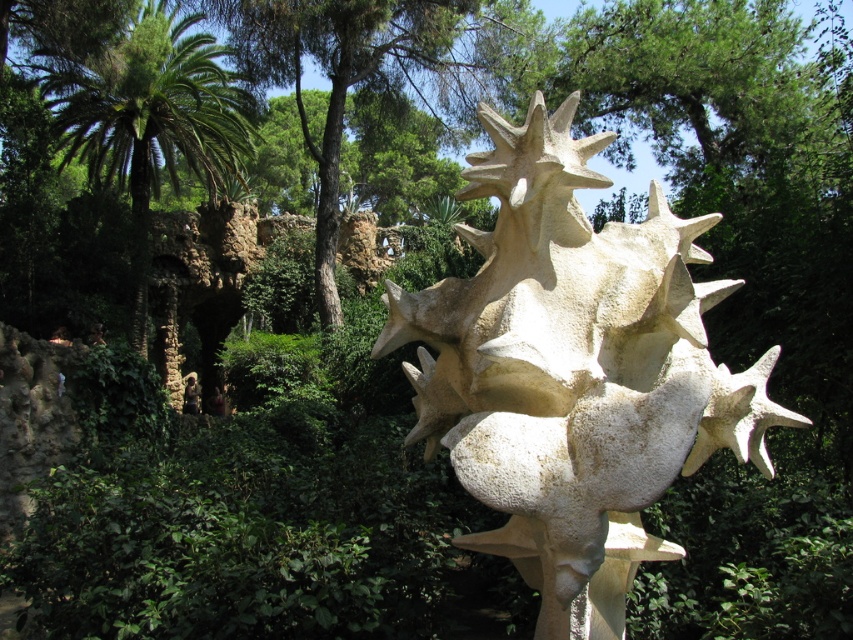
Can you confirm if green leafy tree at upper center is wider than green leafy palm at left?

No, green leafy tree at upper center is not wider than green leafy palm at left.

Identify the location of green leafy tree at upper center. (361, 72).

At what (x,y) coordinates should I click in order to perform the action: click on green leafy tree at upper center. Please return your answer as a coordinate pair (x, y). The height and width of the screenshot is (640, 853). Looking at the image, I should click on (361, 72).

Consider the image. Can you confirm if white stone sculpture at center is positioned below green leafy tree at upper center?

Yes, white stone sculpture at center is below green leafy tree at upper center.

From the picture: Does white stone sculpture at center come in front of green leafy tree at upper center?

Yes, it is in front of green leafy tree at upper center.

You are a GUI agent. You are given a task and a screenshot of the screen. Output one action in this format:
    pyautogui.click(x=<x>, y=<y>)
    Task: Click on the white stone sculpture at center
    
    Given the screenshot: What is the action you would take?
    pyautogui.click(x=573, y=371)

Is point (531, 426) positioned before point (219, 177)?

That is True.

Find the location of a particular element. white stone sculpture at center is located at coordinates (573, 371).